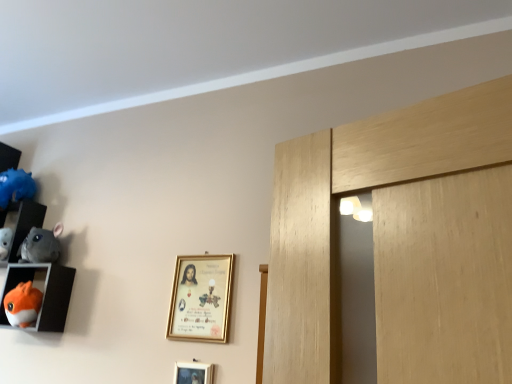
Question: Should I look upward or downward to see orange plush toy at lower left, placed as the first toy when sorted from bottom to top?

Choices:
 (A) up
 (B) down

Answer: (B)

Question: In which direction should I rotate to look at gold metallic picture frame at center, acting as the second picture frame starting from the bottom?

Choices:
 (A) right
 (B) left

Answer: (B)

Question: From a real-world perspective, is blue fluffy toy at left, which is the 1th toy in top-to-bottom order, over gold metallic picture frame at lower center, placed as the first picture frame when sorted from bottom to top?

Choices:
 (A) yes
 (B) no

Answer: (A)

Question: From a real-world perspective, does blue fluffy toy at left, which appears as the 3th toy when ordered from the bottom, sit lower than gold metallic picture frame at lower center, placed as the first picture frame when sorted from bottom to top?

Choices:
 (A) no
 (B) yes

Answer: (A)

Question: Is blue fluffy toy at left, which appears as the 3th toy when ordered from the bottom, positioned with its back to gold metallic picture frame at lower center, the second picture frame viewed from the top?

Choices:
 (A) yes
 (B) no

Answer: (B)

Question: Is blue fluffy toy at left, which appears as the 3th toy when ordered from the bottom, far away from gold metallic picture frame at lower center, placed as the first picture frame when sorted from bottom to top?

Choices:
 (A) yes
 (B) no

Answer: (A)

Question: Can gold metallic picture frame at lower center, placed as the first picture frame when sorted from bottom to top, be found inside blue fluffy toy at left, which is the 1th toy in top-to-bottom order?

Choices:
 (A) no
 (B) yes

Answer: (A)

Question: Is the depth of blue fluffy toy at left, which is the 1th toy in top-to-bottom order, greater than that of gold metallic picture frame at lower center, placed as the first picture frame when sorted from bottom to top?

Choices:
 (A) no
 (B) yes

Answer: (B)

Question: Is matte plastic shelf at left, the 2th shelf in the bottom-to-top sequence, positioned with its back to blue fluffy toy at left, which appears as the 3th toy when ordered from the bottom?

Choices:
 (A) no
 (B) yes

Answer: (A)

Question: Is blue fluffy toy at left, which is the 1th toy in top-to-bottom order, surrounded by matte plastic shelf at left, which ranks as the 1th shelf in top-to-bottom order?

Choices:
 (A) no
 (B) yes

Answer: (A)

Question: Is matte plastic shelf at left, which ranks as the 1th shelf in top-to-bottom order, not inside blue fluffy toy at left, which appears as the 3th toy when ordered from the bottom?

Choices:
 (A) yes
 (B) no

Answer: (A)

Question: Is matte plastic shelf at left, which ranks as the 1th shelf in top-to-bottom order, thinner than blue fluffy toy at left, which appears as the 3th toy when ordered from the bottom?

Choices:
 (A) no
 (B) yes

Answer: (B)

Question: Does matte plastic shelf at left, which ranks as the 1th shelf in top-to-bottom order, lie behind blue fluffy toy at left, which appears as the 3th toy when ordered from the bottom?

Choices:
 (A) yes
 (B) no

Answer: (B)

Question: From a real-world perspective, is matte plastic shelf at left, the 2th shelf in the bottom-to-top sequence, under blue fluffy toy at left, which is the 1th toy in top-to-bottom order?

Choices:
 (A) no
 (B) yes

Answer: (B)

Question: Considering the relative positions of gray plush chinchilla at left, which ranks as the 2th toy in top-to-bottom order, and matte plastic shelf at left, the 2th shelf in the bottom-to-top sequence, in the image provided, is gray plush chinchilla at left, which ranks as the 2th toy in top-to-bottom order, to the right of matte plastic shelf at left, the 2th shelf in the bottom-to-top sequence, from the viewer's perspective?

Choices:
 (A) no
 (B) yes

Answer: (B)